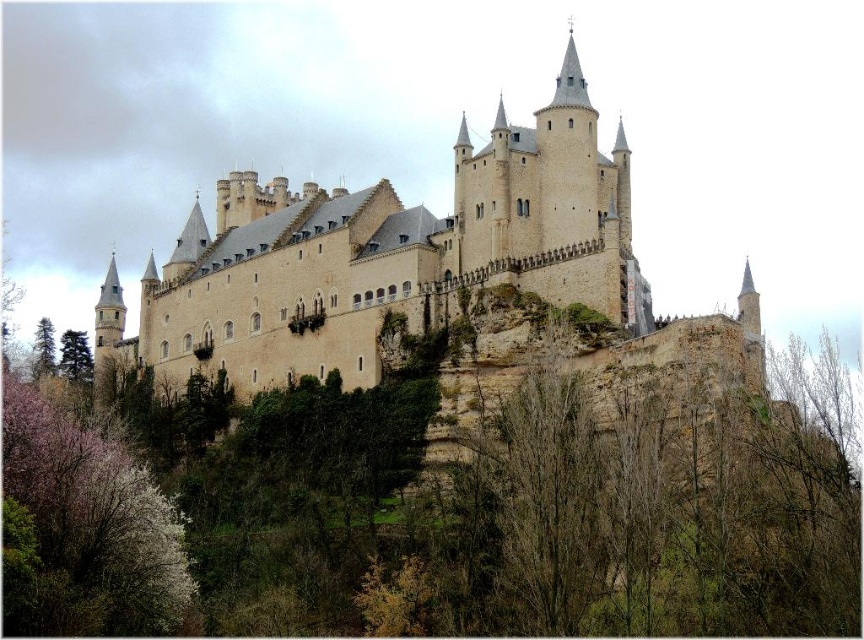
Is point (2, 458) farther from viewer compared to point (43, 364)?

No, (2, 458) is closer to viewer.

Who is shorter, pink blossoming branches at lower left or green matte tree at lower left?

Standing shorter between the two is green matte tree at lower left.

Does point (65, 563) come farther from viewer compared to point (41, 337)?

No, (65, 563) is in front of (41, 337).

Locate an element on the screen. This screenshot has width=864, height=640. pink blossoming branches at lower left is located at coordinates (81, 531).